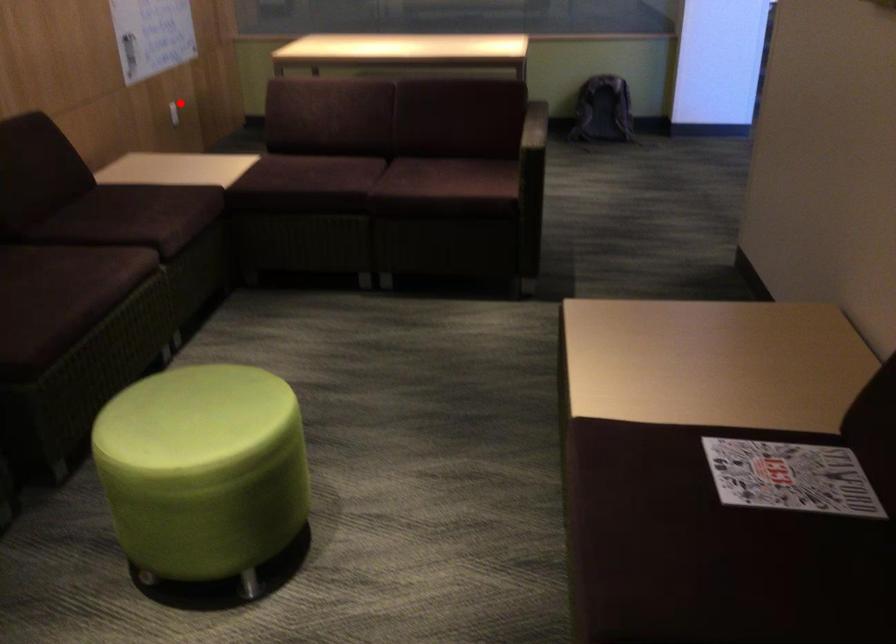
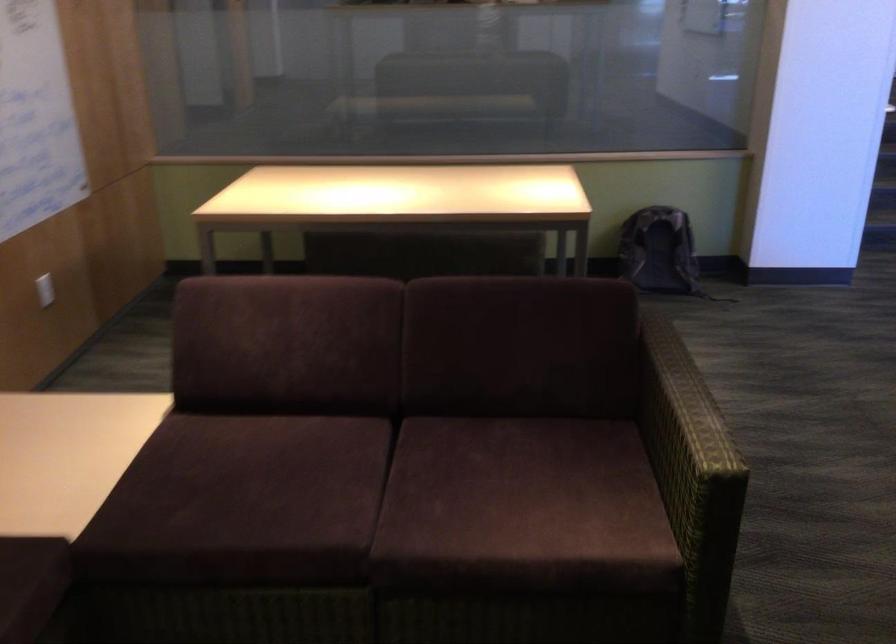
Question: A red point is marked in image1. In image2, is the corresponding 3D point closer to the camera or farther? Reply with the corresponding letter.

Choices:
 (A) The corresponding 3D point is closer.
 (B) The corresponding 3D point is farther.

Answer: (A)